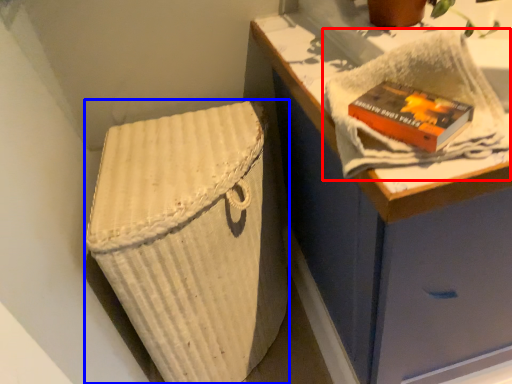
Question: Which object is further to the camera taking this photo, bath towel (highlighted by a red box) or laundry basket (highlighted by a blue box)?

Choices:
 (A) bath towel
 (B) laundry basket

Answer: (B)